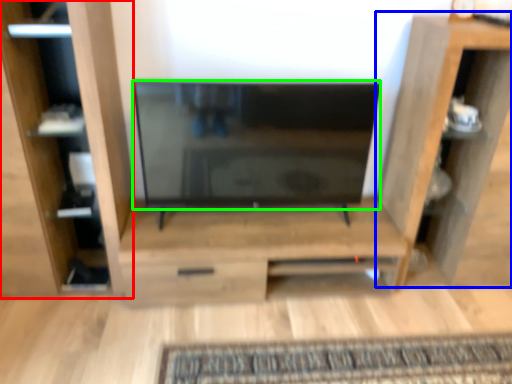
Question: Estimate the real-world distances between objects in this image. Which object is closer to furniture (highlighted by a red box), shelf (highlighted by a blue box) or screen (highlighted by a green box)?

Choices:
 (A) shelf
 (B) screen

Answer: (B)